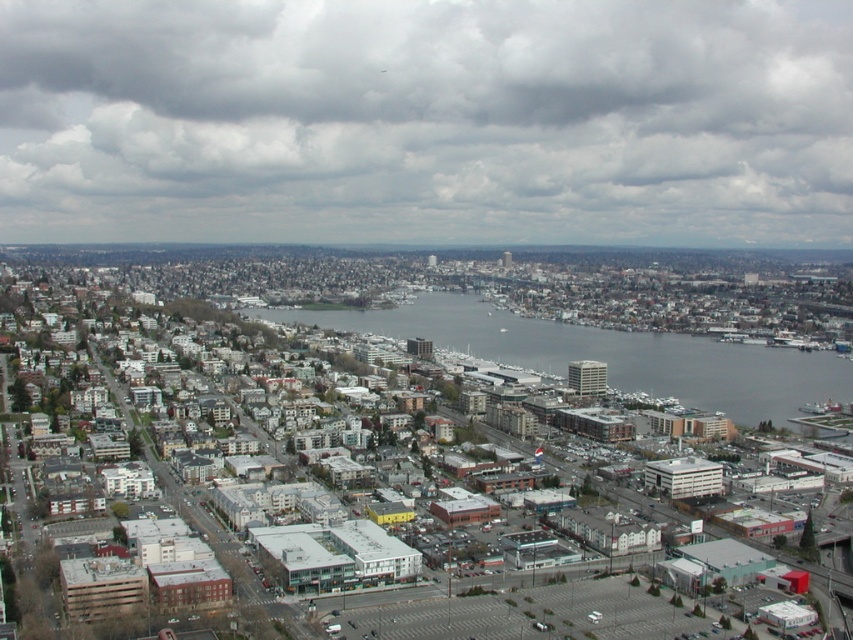
Question: Where is cloudy sky at upper center located in relation to gray water at center in the image?

Choices:
 (A) right
 (B) left

Answer: (B)

Question: Can you confirm if cloudy sky at upper center is wider than gray water at center?

Choices:
 (A) yes
 (B) no

Answer: (A)

Question: Is cloudy sky at upper center to the left of gray water at center from the viewer's perspective?

Choices:
 (A) yes
 (B) no

Answer: (A)